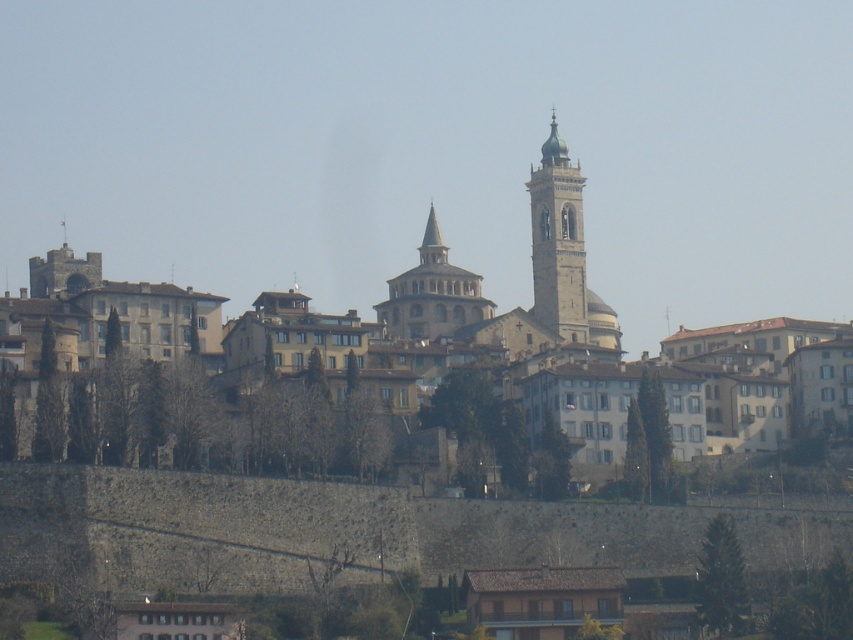
Question: Which point appears closest to the camera in this image?

Choices:
 (A) (410, 326)
 (B) (412, 316)

Answer: (A)

Question: Considering the relative positions of beige stone town at center and light brown stone tower at center in the image provided, where is beige stone town at center located with respect to light brown stone tower at center?

Choices:
 (A) right
 (B) left

Answer: (B)

Question: Which object appears closest to the camera in this image?

Choices:
 (A) beige stone town at center
 (B) light brown stone tower at center
 (C) beige stone tower at center

Answer: (A)

Question: Considering the relative positions of beige stone town at center and light brown stone tower at center in the image provided, where is beige stone town at center located with respect to light brown stone tower at center?

Choices:
 (A) left
 (B) right

Answer: (A)

Question: Estimate the real-world distances between objects in this image. Which object is farther from the beige stone tower at center?

Choices:
 (A) beige stone town at center
 (B) light brown stone tower at center

Answer: (B)

Question: Is beige stone town at center below light brown stone tower at center?

Choices:
 (A) yes
 (B) no

Answer: (A)